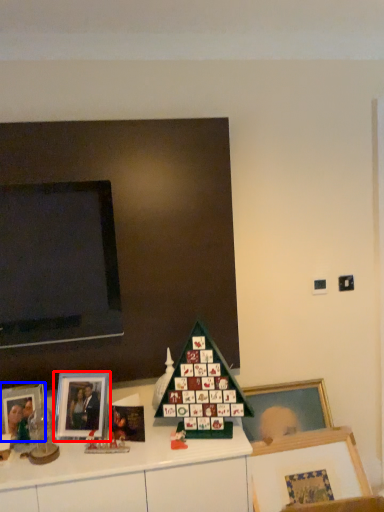
Question: Among these objects, which one is nearest to the camera, picture frame (highlighted by a red box) or picture frame (highlighted by a blue box)?

Choices:
 (A) picture frame
 (B) picture frame

Answer: (B)